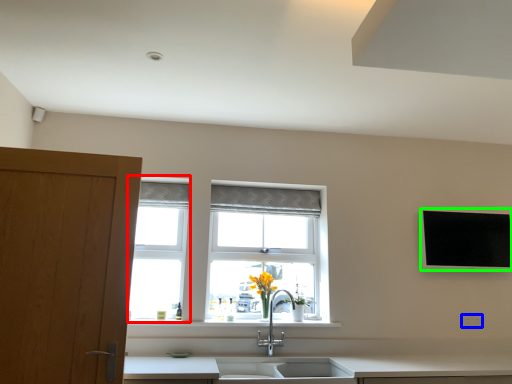
Question: Which object is the farthest from window frame (highlighted by a red box)? Choose among these: electric outlet (highlighted by a blue box) or flat (highlighted by a green box).

Choices:
 (A) electric outlet
 (B) flat

Answer: (A)